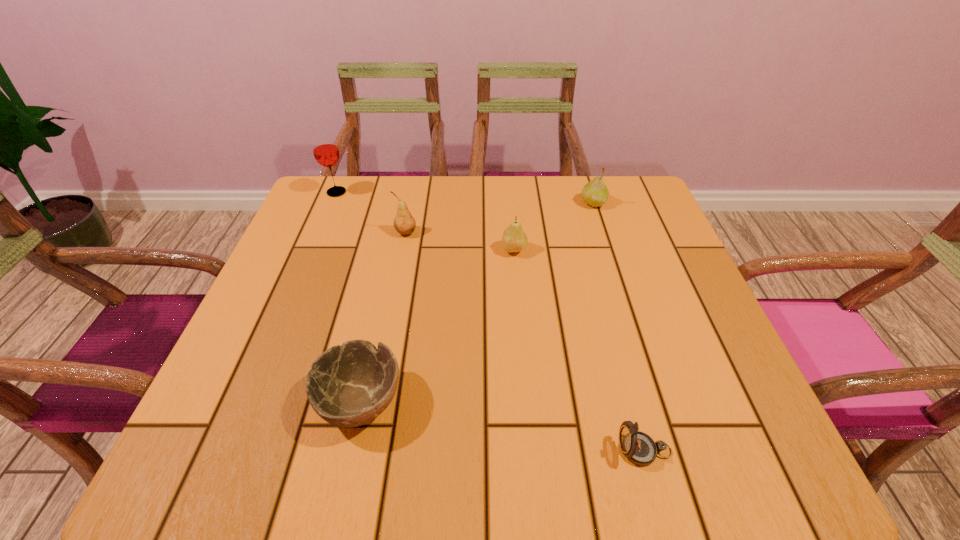
Where is `object positioned at the left edge`? This screenshot has height=540, width=960. object positioned at the left edge is located at coordinates (324, 146).

At what (x,y) coordinates should I click in order to perform the action: click on pear that is at the right edge. Please return your answer as a coordinate pair (x, y). This screenshot has height=540, width=960. Looking at the image, I should click on (595, 193).

Locate an element on the screen. The height and width of the screenshot is (540, 960). compass located at the right edge is located at coordinates (639, 448).

Find the location of `object situated at the far left corner`. object situated at the far left corner is located at coordinates (324, 146).

What are the coordinates of `object located in the far right corner section of the desktop` in the screenshot? It's located at (595, 193).

Image resolution: width=960 pixels, height=540 pixels. I want to click on object situated at the near right corner, so click(x=639, y=448).

Identify the location of free space at the far edge of the desktop. The height and width of the screenshot is (540, 960). (488, 208).

In the image, there is a desktop. At what (x,y) coordinates should I click in order to perform the action: click on free region at the near edge. Please return your answer as a coordinate pair (x, y). Looking at the image, I should click on (409, 427).

The height and width of the screenshot is (540, 960). In order to click on vacant space at the left edge of the desktop in this screenshot , I will do `click(279, 306)`.

In the image, there is a desktop. Where is `free space at the right edge`? free space at the right edge is located at coordinates (692, 308).